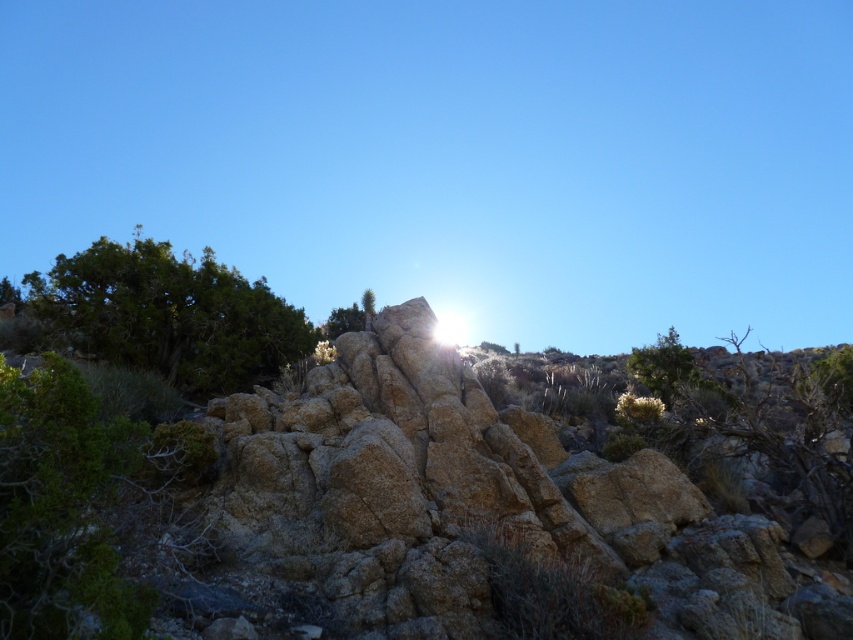
Does green leafy tree at upper left have a greater width compared to green leafy tree at upper right?

Yes.

Which is in front, point (103, 291) or point (653, 376)?

Positioned in front is point (103, 291).

The height and width of the screenshot is (640, 853). I want to click on green leafy tree at upper left, so click(169, 314).